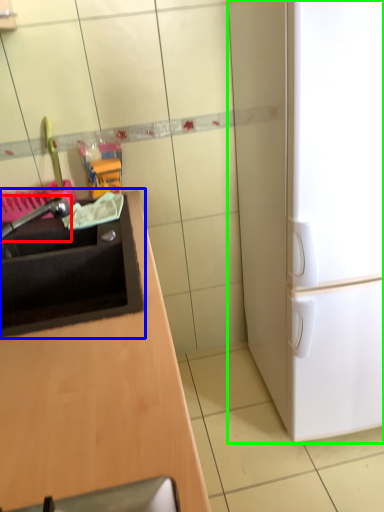
Question: Estimate the real-world distances between objects in this image. Which object is farther from faucet (highlighted by a red box), sink (highlighted by a blue box) or refrigerator (highlighted by a green box)?

Choices:
 (A) sink
 (B) refrigerator

Answer: (B)